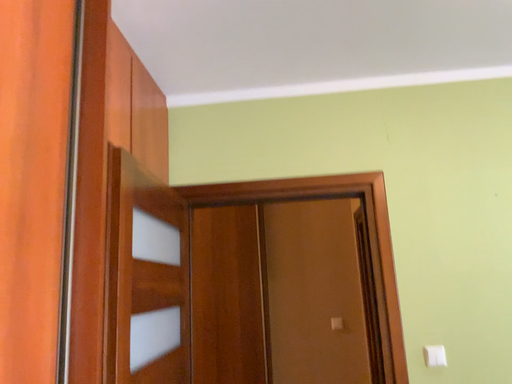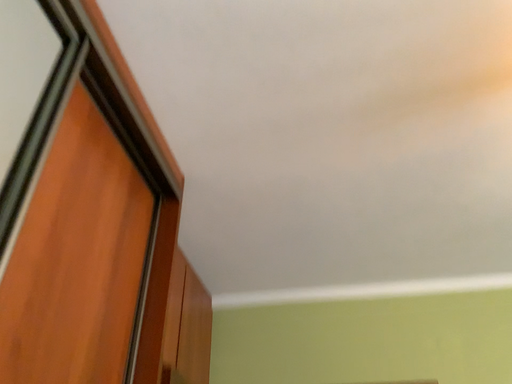
Question: Which way did the camera rotate in the video?

Choices:
 (A) rotated upward
 (B) rotated downward

Answer: (A)